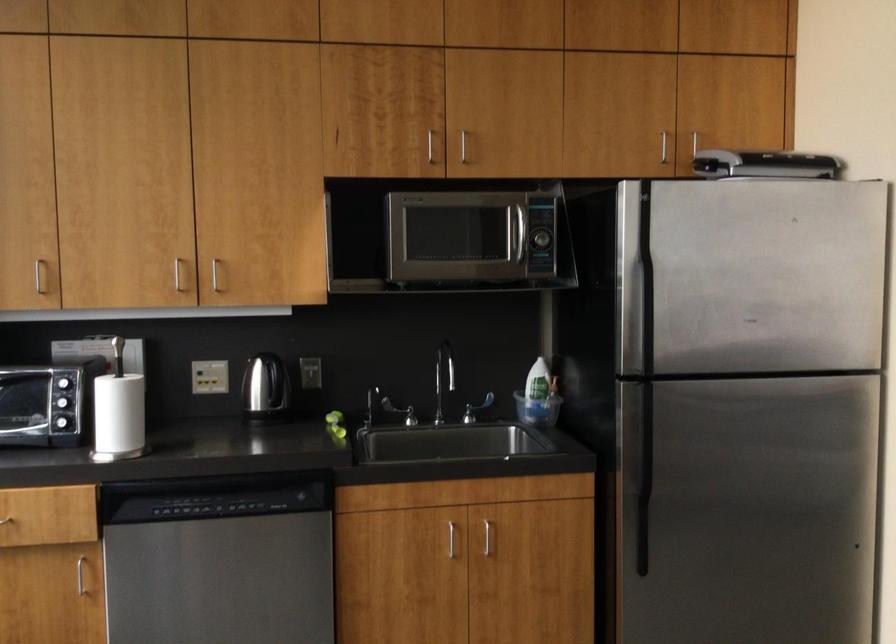
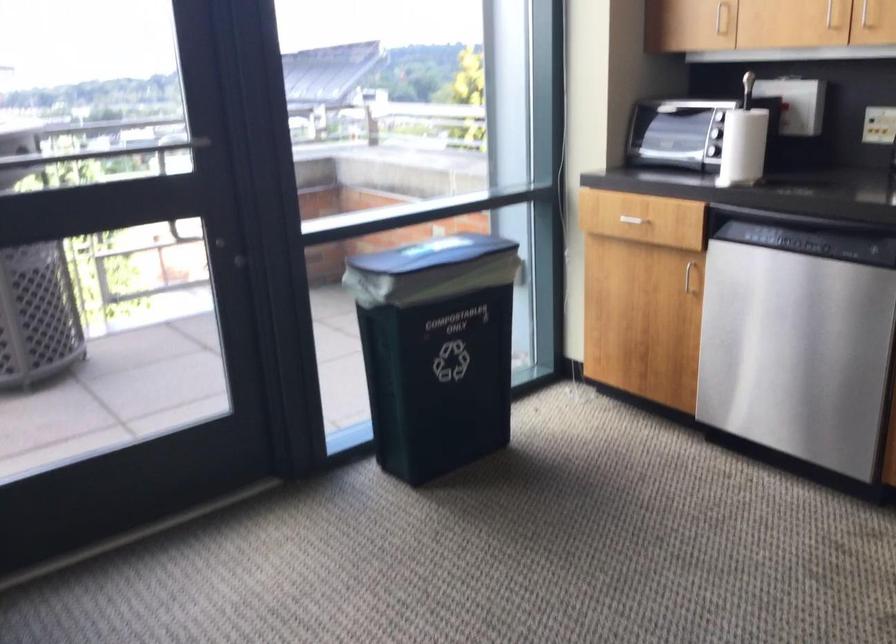
Locate, in the second image, the point that corresponds to the point at 207,281 in the first image.

(865, 15)